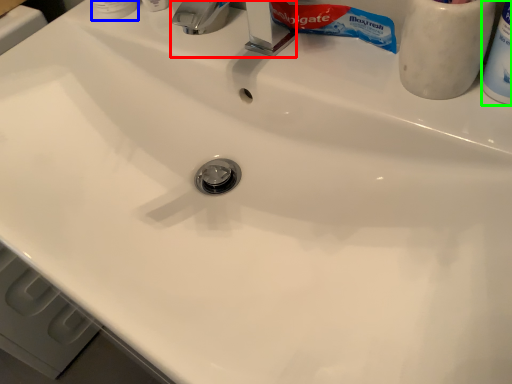
Question: Which object is positioned closest to faucet (highlighted by a red box)? Select from toiletry (highlighted by a blue box) and toiletry (highlighted by a green box).

Choices:
 (A) toiletry
 (B) toiletry

Answer: (A)